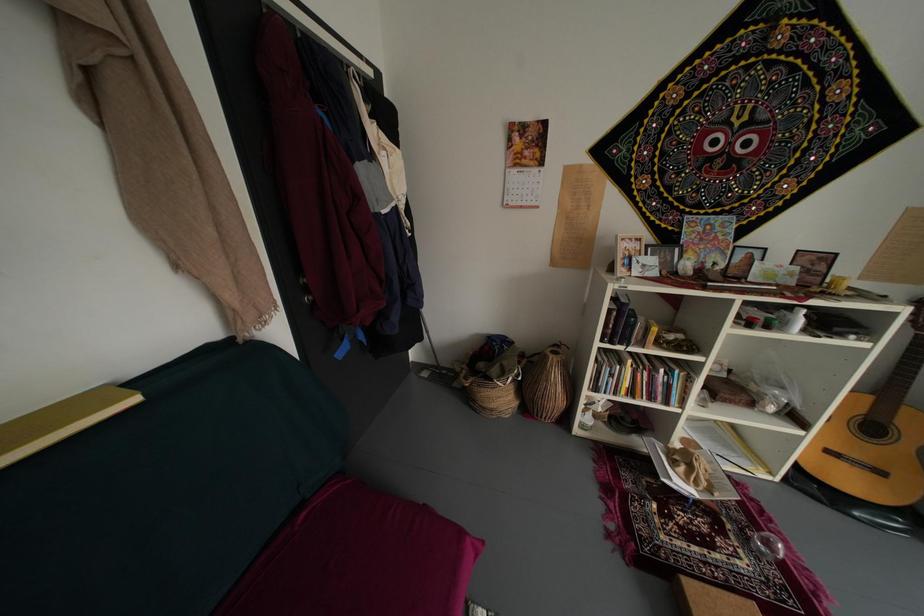
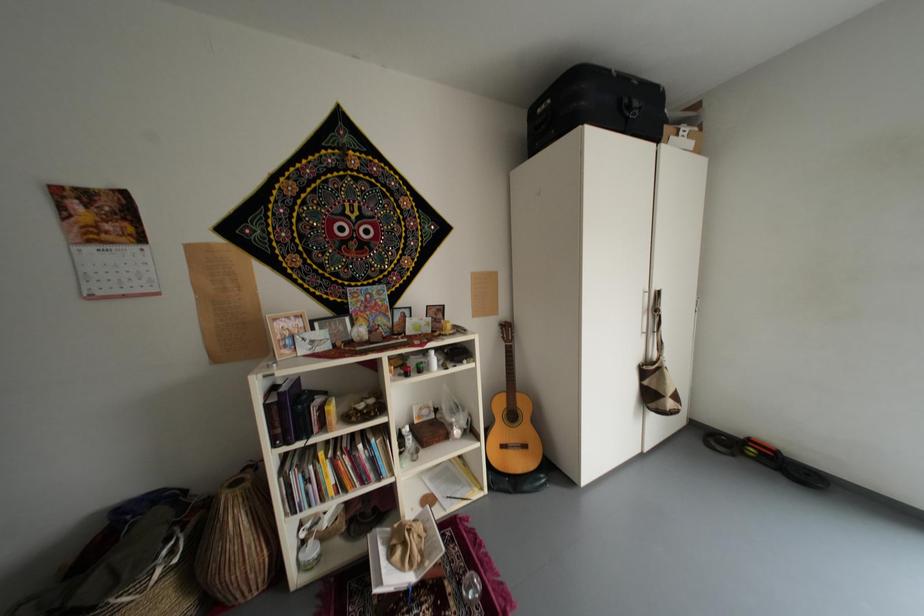
Question: The first image is from the beginning of the video and the second image is from the end. How did the camera likely rotate when shooting the video?

Choices:
 (A) Left
 (B) Right
 (C) Up
 (D) Down

Answer: (B)